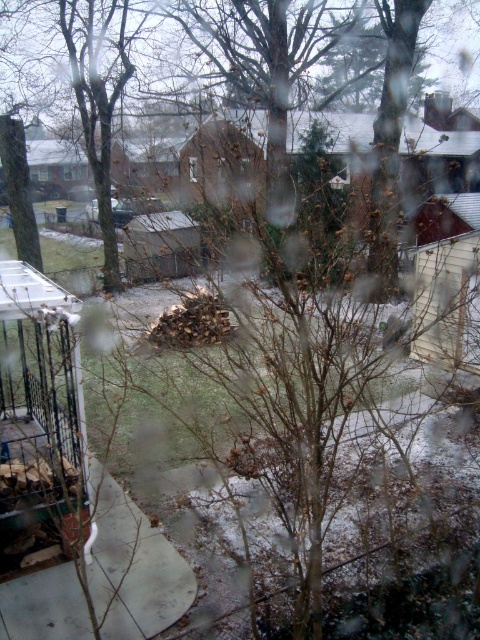
You are standing inside the building and looking through the window. Where is the brown leafless tree at center positioned relative to the window frame?

The brown leafless tree at center is positioned at point 0.206 on the horizontal axis and 0.802 on the vertical axis relative to the window frame.

You are an interior designer assessing the view from a living room window. You see the brown leafless tree at center and the transparent glass window at center. Which object is bigger in the image?

The brown leafless tree at center is larger in size compared to the transparent glass window at center according to the description.